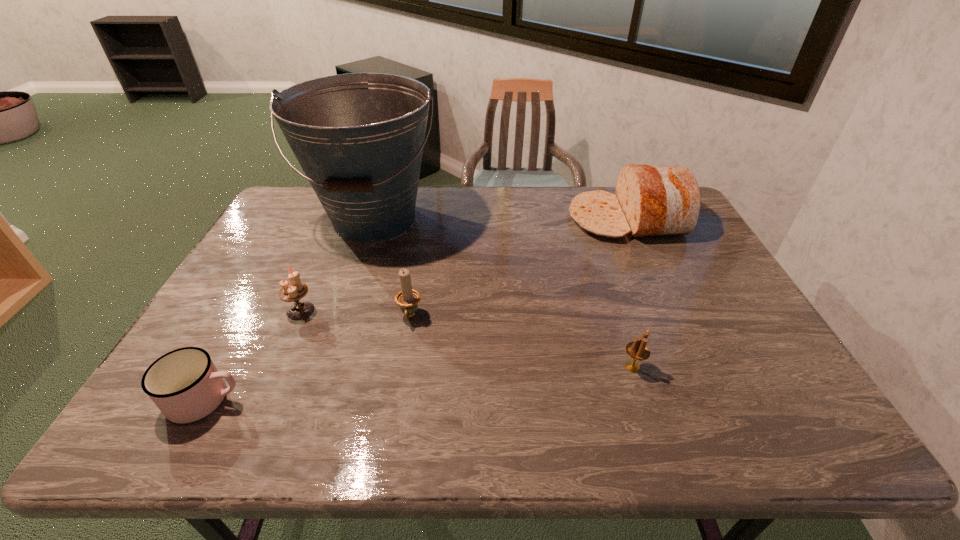
I want to click on object that is at the far left corner, so click(x=359, y=137).

The height and width of the screenshot is (540, 960). I want to click on object that is at the near left corner, so click(x=185, y=385).

Locate an element on the screen. The image size is (960, 540). object located in the far right corner section of the desktop is located at coordinates (651, 200).

Locate an element on the screen. The width and height of the screenshot is (960, 540). free space at the far edge is located at coordinates (449, 192).

I want to click on vacant space at the near edge, so click(451, 411).

In the image, there is a desktop. Identify the location of vacant area at the left edge. (261, 272).

You are a GUI agent. You are given a task and a screenshot of the screen. Output one action in this format:
    pyautogui.click(x=<x>, y=<y>)
    Task: Click on the free space at the right edge
    
    Given the screenshot: What is the action you would take?
    click(792, 405)

The width and height of the screenshot is (960, 540). In order to click on free space at the near right corner in this screenshot , I will do 815,411.

The image size is (960, 540). Identify the location of vacant space in between the second candle holder from right to left and the fifth shortest object. (518, 268).

At what (x,y) coordinates should I click in order to perform the action: click on free space between the second candle holder from left to right and the nearest candle holder. Please return your answer as a coordinate pair (x, y). Looking at the image, I should click on (521, 342).